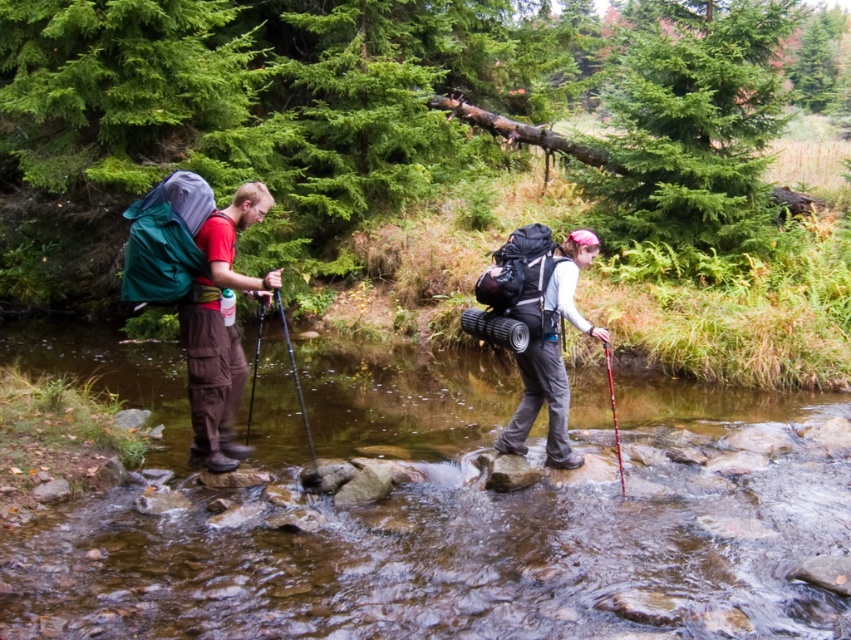
Consider the image. You are a hiker planning to cross the stream. You see the clear water at center and the matte green backpack at left. Which object should you avoid stepping on to stay safe?

You should avoid stepping on the matte green backpack at left because it is positioned to the left of the clear water at center, which is where the stream flows. Stepping on the backpack could disturb it or lead to an unstable footing.

You are a photographer standing in the forest scene. You want to take a photo of both the matte green backpack at left and the matte black backpack at center. Which backpack should you focus on first to ensure it appears larger in the photo?

The matte green backpack at left is closer to the viewer than the matte black backpack at center. Since objects closer to the camera appear larger, focusing on the matte green backpack at left first will make it appear larger in the photo.